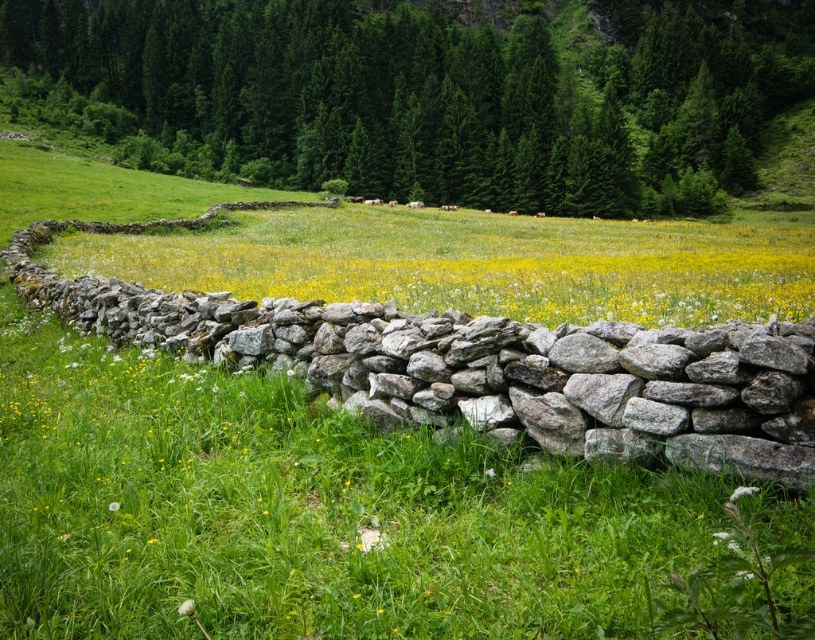
Question: Which object is positioned farthest from the yellow grass at center?

Choices:
 (A) white fluffy dandelion at lower left
 (B) white fluffy flower at lower right

Answer: (A)

Question: Which object appears farthest from the camera in this image?

Choices:
 (A) white fluffy dandelion at lower left
 (B) white fluffy flower at lower right
 (C) yellow grass at center

Answer: (C)

Question: Among these objects, which one is nearest to the camera?

Choices:
 (A) white fluffy dandelion at lower left
 (B) white fluffy flower at lower right
 (C) yellow grass at center

Answer: (B)

Question: From the image, what is the correct spatial relationship of yellow grass at center in relation to white fluffy flower at lower right?

Choices:
 (A) right
 (B) left

Answer: (A)

Question: Does yellow grass at center appear on the right side of white fluffy flower at lower right?

Choices:
 (A) yes
 (B) no

Answer: (A)

Question: Does yellow grass at center appear on the left side of white fluffy flower at lower right?

Choices:
 (A) no
 (B) yes

Answer: (A)